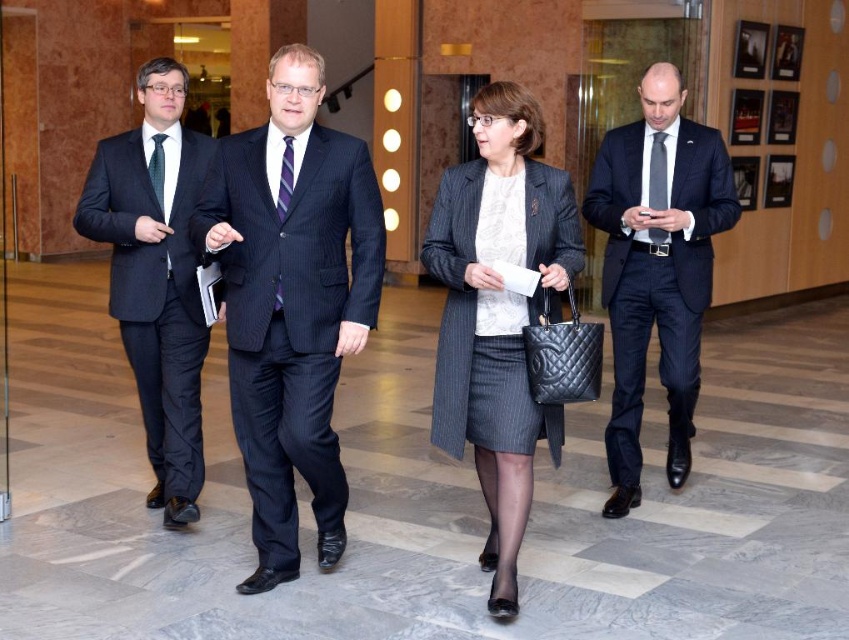
Question: Considering the real-world distances, which object is closest to the matte black suit at left?

Choices:
 (A) matte black suit at right
 (B) matte gray tie at center
 (C) black silk tie at left

Answer: (C)

Question: Can you confirm if matte black suit at right is smaller than striped silk tie at center?

Choices:
 (A) yes
 (B) no

Answer: (B)

Question: Does striped silk tie at center have a larger size compared to black silk tie at left?

Choices:
 (A) yes
 (B) no

Answer: (B)

Question: Can you confirm if matte black suit at left is positioned to the right of striped silk tie at center?

Choices:
 (A) yes
 (B) no

Answer: (B)

Question: Which point appears farthest from the camera in this image?

Choices:
 (A) (644, 252)
 (B) (659, 150)
 (C) (280, 298)
 (D) (155, 189)

Answer: (B)

Question: Estimate the real-world distances between objects in this image. Which object is closer to the matte gray coat at center?

Choices:
 (A) pinstriped suit at center
 (B) matte gray tie at center
 (C) black silk tie at left

Answer: (A)